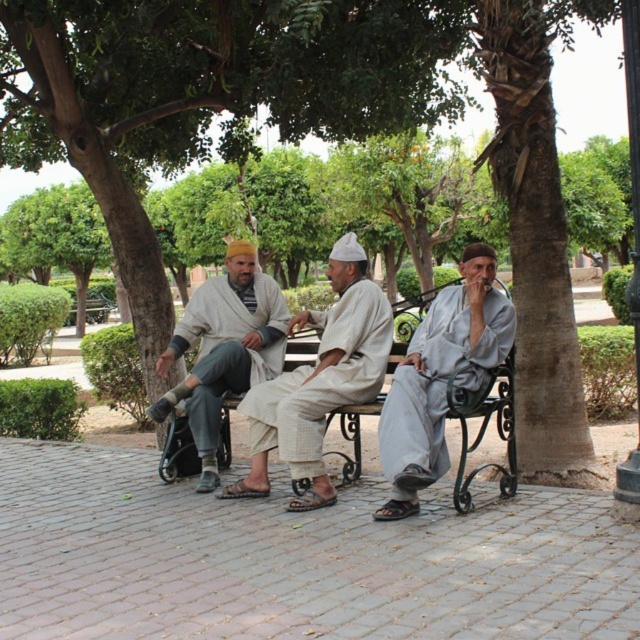
Question: Can you confirm if light beige fabric robe at center is positioned above matte gray robe at center?

Choices:
 (A) yes
 (B) no

Answer: (B)

Question: Which object appears closest to the camera in this image?

Choices:
 (A) light gray cotton robe at center
 (B) green leafy tree at center
 (C) light beige fabric robe at center
 (D) matte gray robe at center

Answer: (A)

Question: Which point appears closest to the camera in this image?

Choices:
 (A) (483, 390)
 (B) (253, 406)
 (C) (218, 332)

Answer: (A)

Question: Is light gray cotton robe at center to the left of matte gray robe at center from the viewer's perspective?

Choices:
 (A) no
 (B) yes

Answer: (A)

Question: Which of the following is the closest to the observer?

Choices:
 (A) (326, 340)
 (B) (109, 48)

Answer: (A)

Question: Does green leafy tree at center have a lesser width compared to light beige fabric robe at center?

Choices:
 (A) no
 (B) yes

Answer: (B)